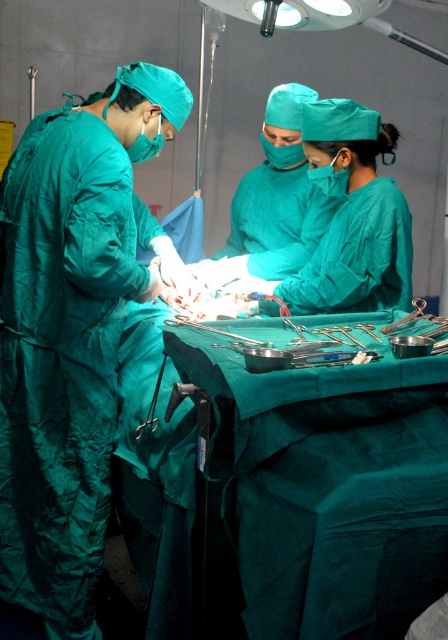
Question: Which point is closer to the camera?

Choices:
 (A) metallic silver surgical instruments at center
 (B) teal matte/green surgical gown at left

Answer: (A)

Question: Among these objects, which one is nearest to the camera?

Choices:
 (A) metallic silver surgical instruments at center
 (B) teal matte/green surgical gown at left

Answer: (A)

Question: Which point is farther from the camera taking this photo?

Choices:
 (A) (30, 346)
 (B) (188, 317)

Answer: (B)

Question: Is teal matte/green surgical gown at left smaller than metallic silver surgical instruments at center?

Choices:
 (A) yes
 (B) no

Answer: (B)

Question: Does teal matte/green surgical gown at left appear over metallic silver surgical instruments at center?

Choices:
 (A) yes
 (B) no

Answer: (B)

Question: Is teal matte/green surgical gown at left smaller than metallic silver surgical instruments at center?

Choices:
 (A) no
 (B) yes

Answer: (A)